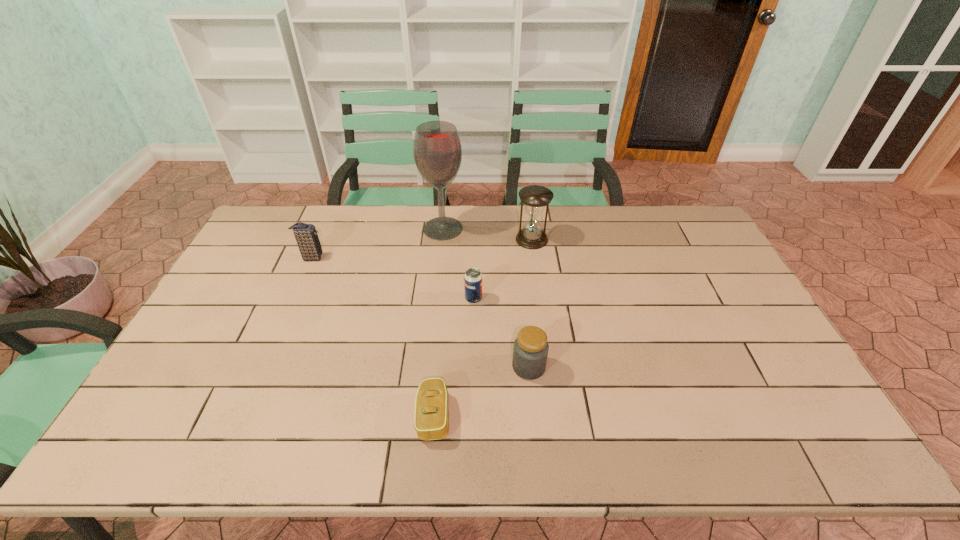
Image resolution: width=960 pixels, height=540 pixels. In the image, there is a desktop. What are the coordinates of `vacant space at the far edge` in the screenshot? It's located at (311, 217).

You are a GUI agent. You are given a task and a screenshot of the screen. Output one action in this format:
    pyautogui.click(x=<x>, y=<y>)
    Task: Click on the vacant area at the left edge of the desktop
    The height and width of the screenshot is (540, 960).
    Given the screenshot: What is the action you would take?
    pyautogui.click(x=181, y=379)

In the image, there is a desktop. Where is `free space at the right edge`? The height and width of the screenshot is (540, 960). free space at the right edge is located at coordinates (778, 394).

The height and width of the screenshot is (540, 960). What are the coordinates of `blank space at the far left corner of the desktop` in the screenshot? It's located at (284, 216).

Where is `free point between the shorter clutch bag and the jar`? free point between the shorter clutch bag and the jar is located at coordinates (481, 392).

The image size is (960, 540). Find the location of `vacant area that lies between the tallest object and the hourglass`. vacant area that lies between the tallest object and the hourglass is located at coordinates (488, 234).

What are the coordinates of `vacant area that lies between the nearest object and the alcohol` in the screenshot? It's located at (439, 322).

Identify the location of free point between the farther clutch bag and the shorter clutch bag. The height and width of the screenshot is (540, 960). (372, 337).

This screenshot has height=540, width=960. In order to click on free space between the shortest object and the left clutch bag in this screenshot , I will do (372, 337).

Where is `free area in between the second shortest object and the right clutch bag`? free area in between the second shortest object and the right clutch bag is located at coordinates (454, 357).